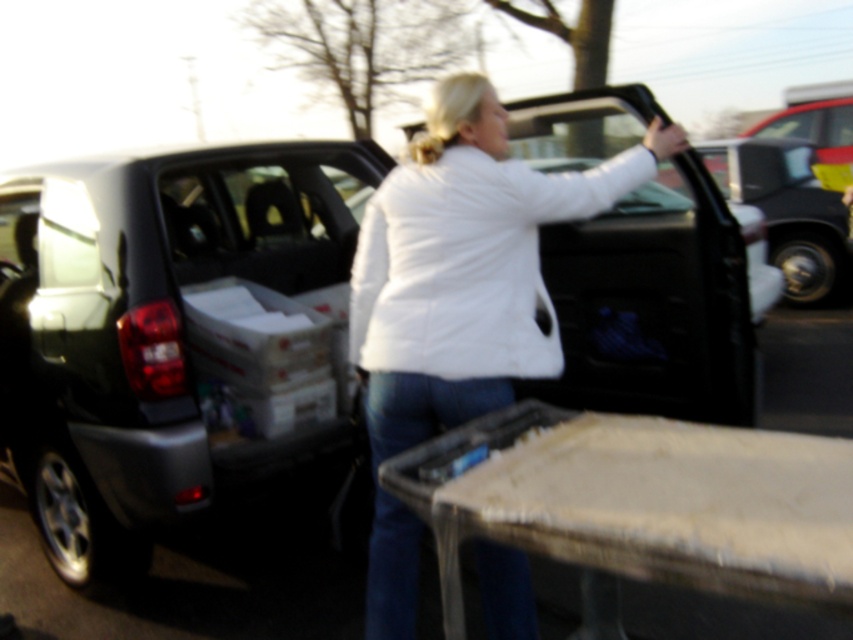
Question: Does metallic gray car at center appear under white puffy jacket at center?

Choices:
 (A) yes
 (B) no

Answer: (B)

Question: Can you confirm if metallic gray car at center is positioned to the left of white puffy jacket at center?

Choices:
 (A) yes
 (B) no

Answer: (A)

Question: Observing the image, what is the correct spatial positioning of metallic gray car at center in reference to white puffy jacket at center?

Choices:
 (A) below
 (B) above

Answer: (B)

Question: Among these points, which one is farthest from the camera?

Choices:
 (A) click(491, 240)
 (B) click(73, 301)

Answer: (B)